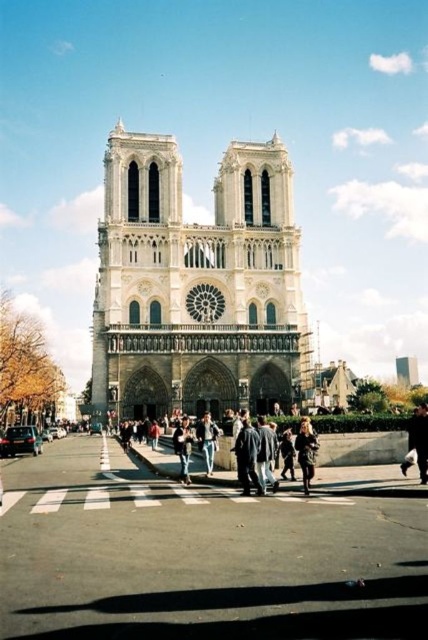
You are a photographer standing in front of Notre Dame Cathedral. You want to capture both the dark brown leather jacket at lower right and the denim jacket at center in a single photo. Which jacket will appear bigger in the photo?

The dark brown leather jacket at lower right will appear bigger in the photo because it has a larger size compared to the denim jacket at center.

You are a tourist standing in front of Notre Dame Cathedral and you see a dark brown leather jacket at lower right and a denim jacket at center. Which jacket is positioned more to the right side of the scene?

The dark brown leather jacket at lower right is positioned more to the right side of the scene compared to the denim jacket at center.

You are standing at the center of the pedestrian crossing in front of Notre Dame Cathedral. You want to find the dark brown leather jacket at lower right. In which direction should you look relative to your position?

You should look towards the lower right direction from your position at the center of the pedestrian crossing to locate the dark brown leather jacket at lower right.